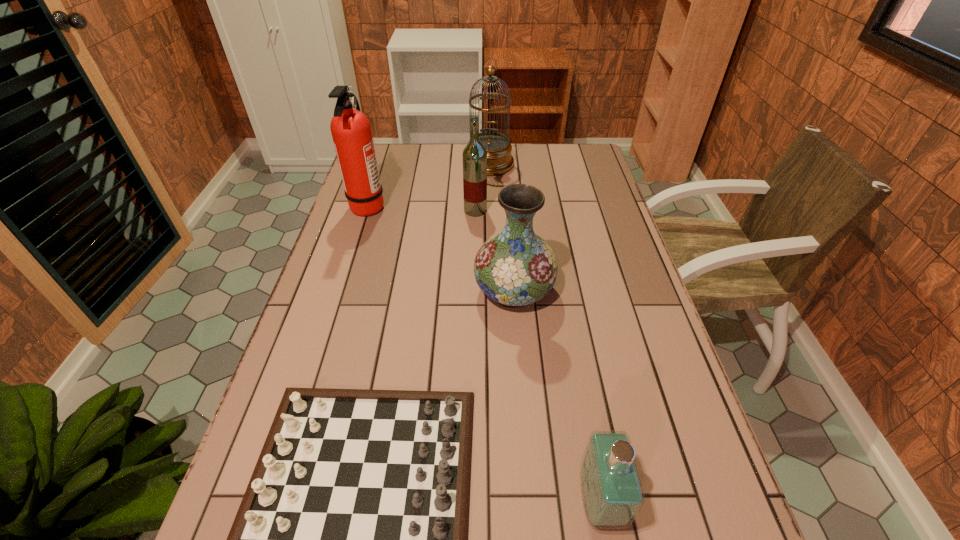
The image size is (960, 540). Find the location of `fire extinguisher`. fire extinguisher is located at coordinates (351, 131).

Locate an element on the screen. The height and width of the screenshot is (540, 960). the farthest object is located at coordinates (499, 159).

Locate an element on the screen. This screenshot has width=960, height=540. liquor is located at coordinates (474, 155).

Identify the location of vase. The height and width of the screenshot is (540, 960). (516, 267).

Identify the location of the fifth tallest object. (612, 493).

Find the location of a particular element. free space located on the handle side of the fire extinguisher is located at coordinates (449, 206).

This screenshot has width=960, height=540. Identify the location of free space located with an open door on the birdcage. (491, 218).

This screenshot has height=540, width=960. Find the location of `vacant space located 0.080m on the back of the liquor`. vacant space located 0.080m on the back of the liquor is located at coordinates (475, 191).

This screenshot has height=540, width=960. Identify the location of free space located 0.110m on the front of the vase. (519, 356).

In order to click on vacant space located on the front label of the fifth tallest object in this screenshot , I will do `click(503, 501)`.